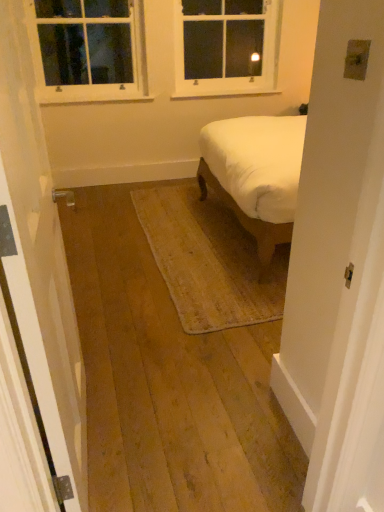
Question: Should I look upward or downward to see white glass window at upper center, which is the second window from left to right?

Choices:
 (A) down
 (B) up

Answer: (B)

Question: From a real-world perspective, does white painted wood window at upper left, which appears as the first window when viewed from the left, stand above white wooden door at left?

Choices:
 (A) yes
 (B) no

Answer: (A)

Question: Is white painted wood window at upper left, which appears as the first window when viewed from the left, thinner than white wooden door at left?

Choices:
 (A) no
 (B) yes

Answer: (A)

Question: From the image's perspective, does white painted wood window at upper left, which appears as the first window when viewed from the left, appear higher than white wooden door at left?

Choices:
 (A) yes
 (B) no

Answer: (A)

Question: Can you confirm if white painted wood window at upper left, acting as the second window starting from the right, is positioned to the right of white wooden door at left?

Choices:
 (A) yes
 (B) no

Answer: (B)

Question: Can you confirm if white painted wood window at upper left, which appears as the first window when viewed from the left, is wider than white wooden door at left?

Choices:
 (A) no
 (B) yes

Answer: (B)

Question: Is white painted wood window at upper left, which appears as the first window when viewed from the left, facing towards white wooden door at left?

Choices:
 (A) no
 (B) yes

Answer: (B)

Question: Can you confirm if white wooden door at left is positioned to the right of white painted wood window at upper left, acting as the second window starting from the right?

Choices:
 (A) yes
 (B) no

Answer: (A)

Question: From the image's perspective, is white wooden door at left below white painted wood window at upper left, acting as the second window starting from the right?

Choices:
 (A) no
 (B) yes

Answer: (B)

Question: Considering the relative sizes of white wooden door at left and white painted wood window at upper left, acting as the second window starting from the right, in the image provided, is white wooden door at left wider than white painted wood window at upper left, acting as the second window starting from the right,?

Choices:
 (A) no
 (B) yes

Answer: (A)

Question: From a real-world perspective, is white wooden door at left under white painted wood window at upper left, acting as the second window starting from the right?

Choices:
 (A) no
 (B) yes

Answer: (B)

Question: Is white wooden door at left outside of white painted wood window at upper left, which appears as the first window when viewed from the left?

Choices:
 (A) yes
 (B) no

Answer: (A)

Question: Is white painted wood window at upper left, acting as the second window starting from the right, a part of white wooden door at left?

Choices:
 (A) yes
 (B) no

Answer: (B)

Question: Is white painted wood window at upper left, acting as the second window starting from the right, further to camera compared to white glass window at upper center, which is the second window from left to right?

Choices:
 (A) no
 (B) yes

Answer: (A)